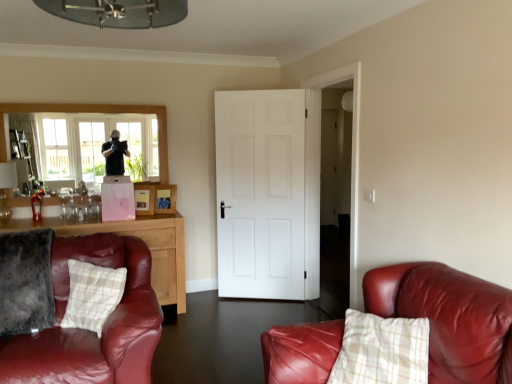
Question: Can we say clear glass window at upper left lies outside leather couch at right?

Choices:
 (A) no
 (B) yes

Answer: (B)

Question: Considering the relative sizes of clear glass window at upper left and leather couch at right in the image provided, is clear glass window at upper left shorter than leather couch at right?

Choices:
 (A) yes
 (B) no

Answer: (B)

Question: Considering the relative positions of clear glass window at upper left and leather couch at right in the image provided, is clear glass window at upper left to the right of leather couch at right from the viewer's perspective?

Choices:
 (A) no
 (B) yes

Answer: (A)

Question: From the image's perspective, is clear glass window at upper left beneath leather couch at right?

Choices:
 (A) no
 (B) yes

Answer: (A)

Question: Considering the relative sizes of clear glass window at upper left and leather couch at right in the image provided, is clear glass window at upper left taller than leather couch at right?

Choices:
 (A) no
 (B) yes

Answer: (B)

Question: Is point (502, 291) positioned closer to the camera than point (181, 253)?

Choices:
 (A) farther
 (B) closer

Answer: (B)

Question: Visually, is leather couch at right positioned to the left or to the right of matte brown cabinet at left?

Choices:
 (A) right
 (B) left

Answer: (A)

Question: Considering their positions, is leather couch at right located in front of or behind matte brown cabinet at left?

Choices:
 (A) behind
 (B) front

Answer: (B)

Question: In terms of width, does leather couch at right look wider or thinner when compared to matte brown cabinet at left?

Choices:
 (A) wide
 (B) thin

Answer: (B)

Question: From the image's perspective, is clear glass window at upper left positioned above or below leather couch at right?

Choices:
 (A) above
 (B) below

Answer: (A)

Question: Is clear glass window at upper left inside or outside of leather couch at right?

Choices:
 (A) inside
 (B) outside

Answer: (B)

Question: Is clear glass window at upper left taller or shorter than leather couch at right?

Choices:
 (A) tall
 (B) short

Answer: (A)

Question: Considering the positions of clear glass window at upper left and leather couch at right in the image, is clear glass window at upper left wider or thinner than leather couch at right?

Choices:
 (A) thin
 (B) wide

Answer: (A)

Question: Is velvety gray pillow at lower left, marked as the 2th pillow in a right-to-left arrangement, in front of or behind matte brown cabinet at left in the image?

Choices:
 (A) front
 (B) behind

Answer: (A)

Question: Considering the relative positions of velvety gray pillow at lower left, marked as the 2th pillow in a right-to-left arrangement, and matte brown cabinet at left in the image provided, is velvety gray pillow at lower left, marked as the 2th pillow in a right-to-left arrangement, to the left or to the right of matte brown cabinet at left?

Choices:
 (A) right
 (B) left

Answer: (B)